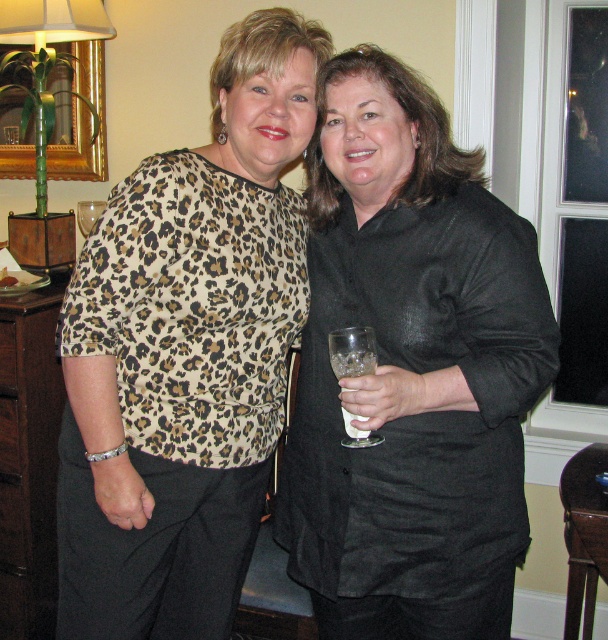
Does black satin blouse at center have a lesser height compared to leopard print blouse at center?

Yes.

Is point (392, 483) positioned before point (188, 572)?

Yes, point (392, 483) is in front of point (188, 572).

Image resolution: width=608 pixels, height=640 pixels. Identify the location of black satin blouse at center. click(412, 371).

Is clear glass wine glass at right to the left of transparent glass at right from the viewer's perspective?

No, clear glass wine glass at right is not to the left of transparent glass at right.

Is clear glass wine glass at right thinner than transparent glass at right?

Incorrect, clear glass wine glass at right's width is not less than transparent glass at right's.

This screenshot has height=640, width=608. What do you see at coordinates (353, 352) in the screenshot?
I see `clear glass wine glass at right` at bounding box center [353, 352].

Where is `clear glass wine glass at right`? The image size is (608, 640). clear glass wine glass at right is located at coordinates click(353, 352).

Between point (94, 330) and point (351, 348), which one is positioned in front?

Point (351, 348) is more forward.

In the scene shown: Is leopard print blouse at center closer to camera compared to clear glass wine glass at right?

No, leopard print blouse at center is further to the viewer.

Identify the location of leopard print blouse at center. Image resolution: width=608 pixels, height=640 pixels. (185, 353).